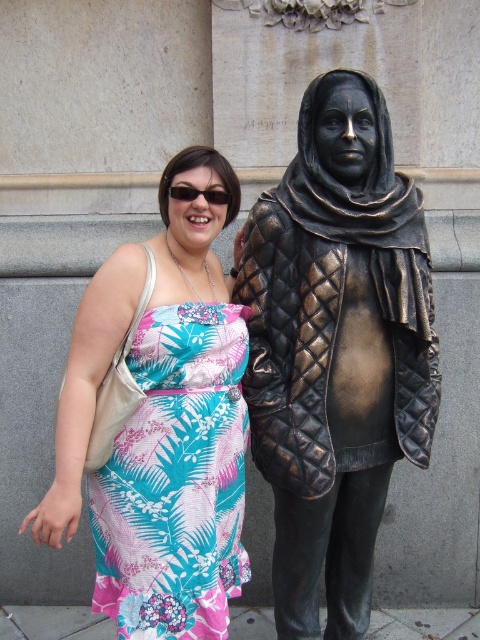
Between bronze quilted jacket at right and printed fabric dress at center, which one appears on the left side from the viewer's perspective?

From the viewer's perspective, printed fabric dress at center appears more on the left side.

Is bronze quilted jacket at right wider than printed fabric dress at center?

Yes, bronze quilted jacket at right is wider than printed fabric dress at center.

Describe the element at coordinates (336, 349) in the screenshot. Image resolution: width=480 pixels, height=640 pixels. I see `bronze quilted jacket at right` at that location.

The image size is (480, 640). I want to click on bronze quilted jacket at right, so click(336, 349).

Between floral print fabric dress at center and black plastic goggles at upper center, which one appears on the left side from the viewer's perspective?

floral print fabric dress at center

Is floral print fabric dress at center shorter than black plastic goggles at upper center?

In fact, floral print fabric dress at center may be taller than black plastic goggles at upper center.

Where is `floral print fabric dress at center`? The height and width of the screenshot is (640, 480). floral print fabric dress at center is located at coordinates (176, 480).

Which is more to the left, printed fabric dress at center or black plastic goggles at upper center?

From the viewer's perspective, printed fabric dress at center appears more on the left side.

Is printed fabric dress at center below black plastic goggles at upper center?

Correct, printed fabric dress at center is located below black plastic goggles at upper center.

From the picture: Who is more forward, (218, 468) or (196, 193)?

Point (218, 468) is in front.

Where is `printed fabric dress at center`? The width and height of the screenshot is (480, 640). printed fabric dress at center is located at coordinates (180, 433).